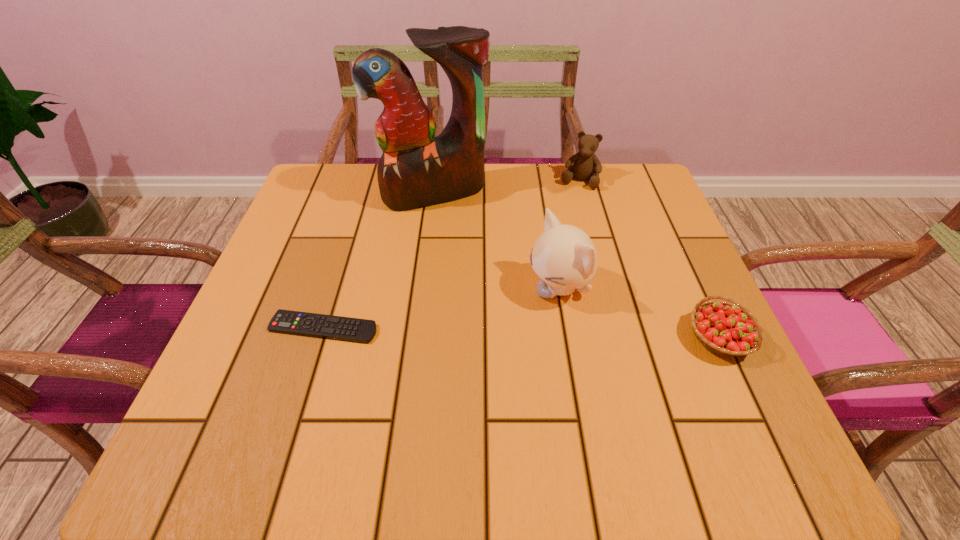
At what (x,y) coordinates should I click in order to perform the action: click on free spot on the desktop that is between the remote control and the rightmost object and is positioned on the front-facing side of the third tallest object. Please return your answer as a coordinate pair (x, y). The height and width of the screenshot is (540, 960). Looking at the image, I should click on (526, 333).

Where is `free space on the desktop that is between the remote control and the second shortest object and is positioned on the face of the fourth shortest object`? The image size is (960, 540). free space on the desktop that is between the remote control and the second shortest object and is positioned on the face of the fourth shortest object is located at coordinates (467, 332).

This screenshot has height=540, width=960. What are the coordinates of `free spot on the desktop that is between the shortest object and the strawberry and is positioned at the face of the tallest object` in the screenshot? It's located at (490, 332).